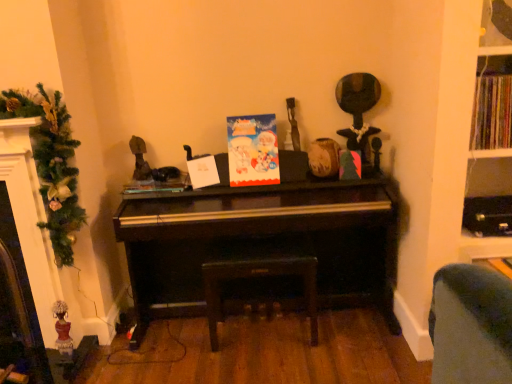
Question: Does point (283, 274) appear closer or farther from the camera than point (198, 240)?

Choices:
 (A) closer
 (B) farther

Answer: (A)

Question: Is leather-like dark brown stool at center in front of or behind shiny black piano at center in the image?

Choices:
 (A) behind
 (B) front

Answer: (A)

Question: Which is nearer to the leather-like dark brown stool at center?

Choices:
 (A) multicolored paper book at upper right
 (B) matte paper card at center
 (C) shiny black piano at center
 (D) green textured garland at left

Answer: (C)

Question: Which object is the farthest from the shiny black piano at center?

Choices:
 (A) green textured garland at left
 (B) matte paper card at center
 (C) leather-like dark brown stool at center
 (D) multicolored paper book at upper right

Answer: (D)